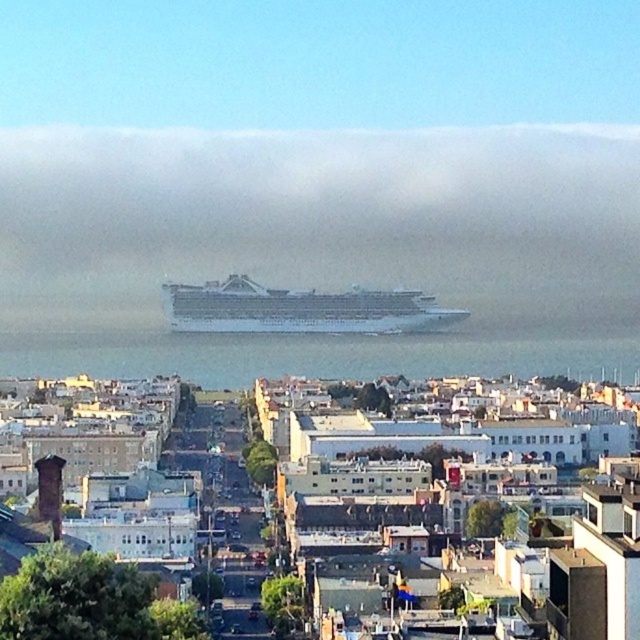
You are standing on the observation deck of a nearby building and want to take a photo of the white matte cruise ship at center. The camera you have can focus on objects up to 500 meters away. Will the cruise ship be in focus?

The white matte cruise ship at center and camera are 523.36 meters apart from each other. Since the camera can only focus up to 500 meters, the cruise ship will be out of focus.